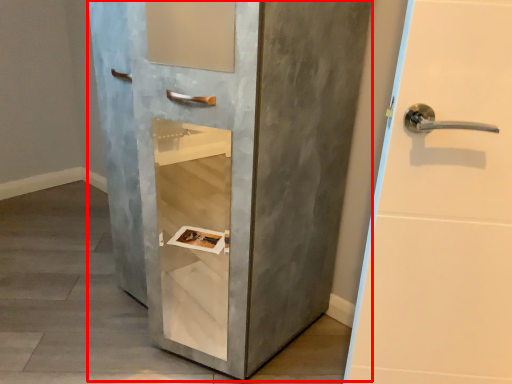
Question: Observing the image, what is the correct spatial positioning of door (annotated by the red box) in reference to concrete?

Choices:
 (A) right
 (B) left

Answer: (A)